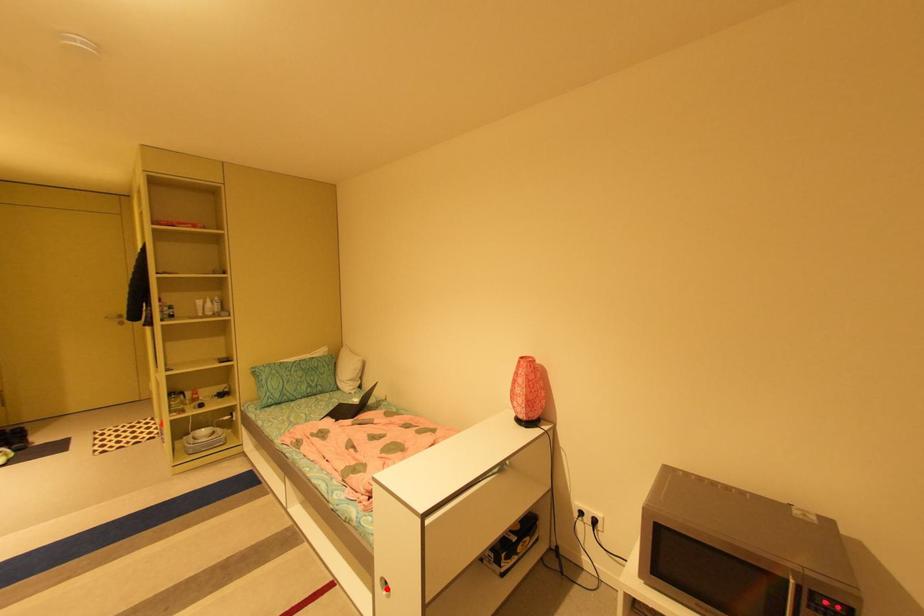
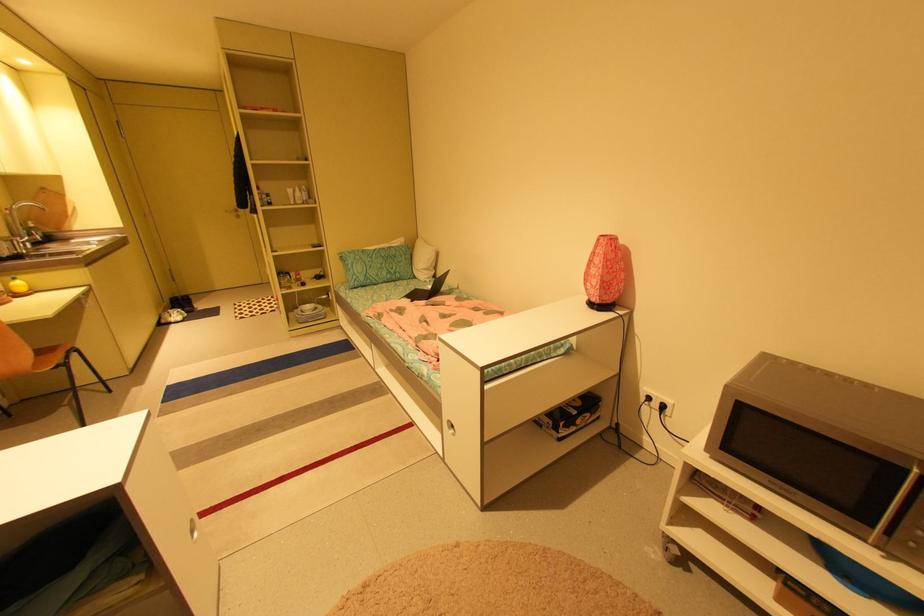
Question: I am providing you with two images of the same scene from different viewpoints. Given a red point in image1, look at the same physical point in image2. Is it:

Choices:
 (A) Closer to the viewpoint
 (B) Farther from the viewpoint

Answer: (B)